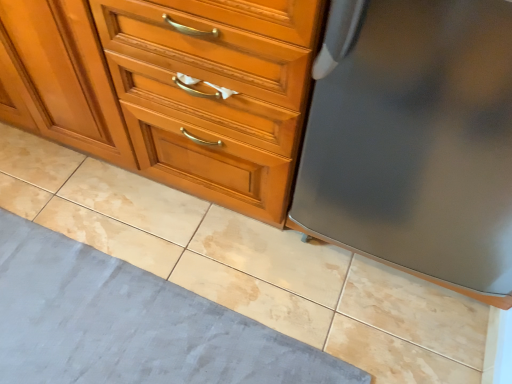
Question: Does matte wood chest of drawers at center have a lesser height compared to gray fabric bath mat at lower left?

Choices:
 (A) yes
 (B) no

Answer: (B)

Question: Does matte wood chest of drawers at center have a greater width compared to gray fabric bath mat at lower left?

Choices:
 (A) yes
 (B) no

Answer: (B)

Question: Is matte wood chest of drawers at center in front of gray fabric bath mat at lower left?

Choices:
 (A) yes
 (B) no

Answer: (A)

Question: Considering the relative positions of matte wood chest of drawers at center and gray fabric bath mat at lower left in the image provided, is matte wood chest of drawers at center to the right of gray fabric bath mat at lower left from the viewer's perspective?

Choices:
 (A) yes
 (B) no

Answer: (B)

Question: From a real-world perspective, is matte wood chest of drawers at center positioned over gray fabric bath mat at lower left based on gravity?

Choices:
 (A) yes
 (B) no

Answer: (A)

Question: Is matte wood chest of drawers at center placed right next to gray fabric bath mat at lower left?

Choices:
 (A) no
 (B) yes

Answer: (A)

Question: From the image's perspective, is gray fabric bath mat at lower left on satin gray refrigerator at right?

Choices:
 (A) no
 (B) yes

Answer: (A)

Question: Does gray fabric bath mat at lower left lie behind satin gray refrigerator at right?

Choices:
 (A) yes
 (B) no

Answer: (A)

Question: Is gray fabric bath mat at lower left looking in the opposite direction of satin gray refrigerator at right?

Choices:
 (A) no
 (B) yes

Answer: (A)

Question: Considering the relative sizes of gray fabric bath mat at lower left and satin gray refrigerator at right in the image provided, is gray fabric bath mat at lower left taller than satin gray refrigerator at right?

Choices:
 (A) no
 (B) yes

Answer: (A)

Question: Could you tell me if gray fabric bath mat at lower left is facing satin gray refrigerator at right?

Choices:
 (A) no
 (B) yes

Answer: (A)

Question: Is gray fabric bath mat at lower left beside satin gray refrigerator at right?

Choices:
 (A) no
 (B) yes

Answer: (A)

Question: Is matte wood chest of drawers at center at the back of satin gray refrigerator at right?

Choices:
 (A) yes
 (B) no

Answer: (B)